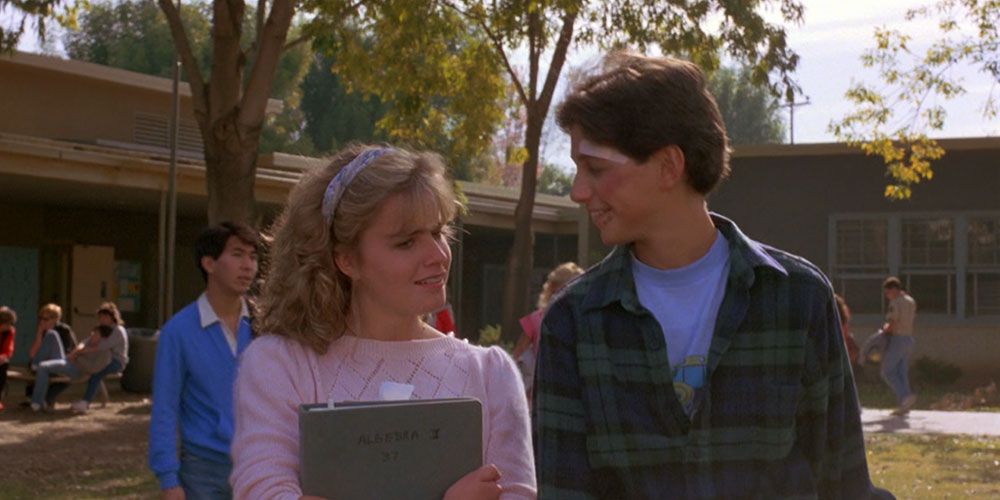
Find the location of a particular element. Image resolution: width=1000 pixels, height=500 pixels. ventilation panels is located at coordinates (155, 132), (188, 139).